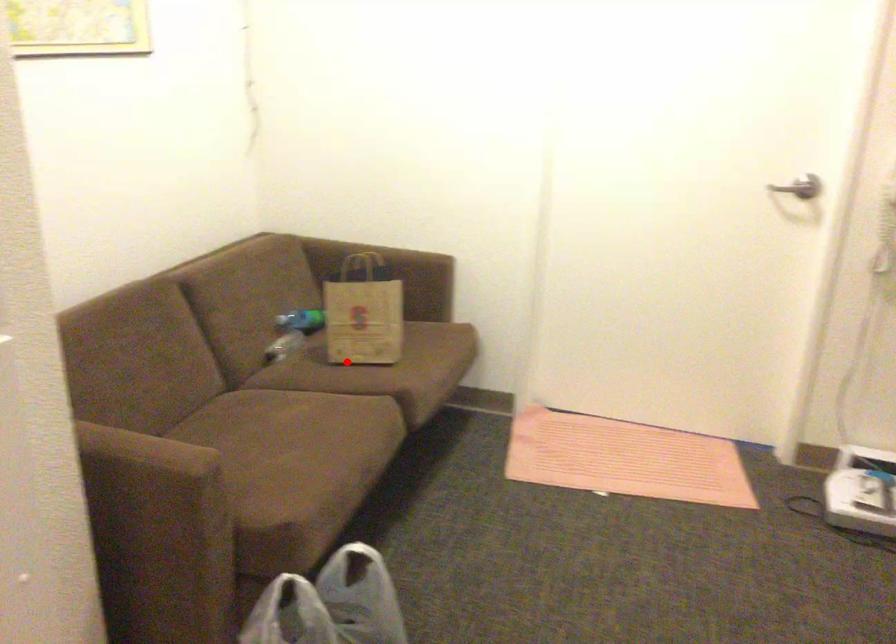
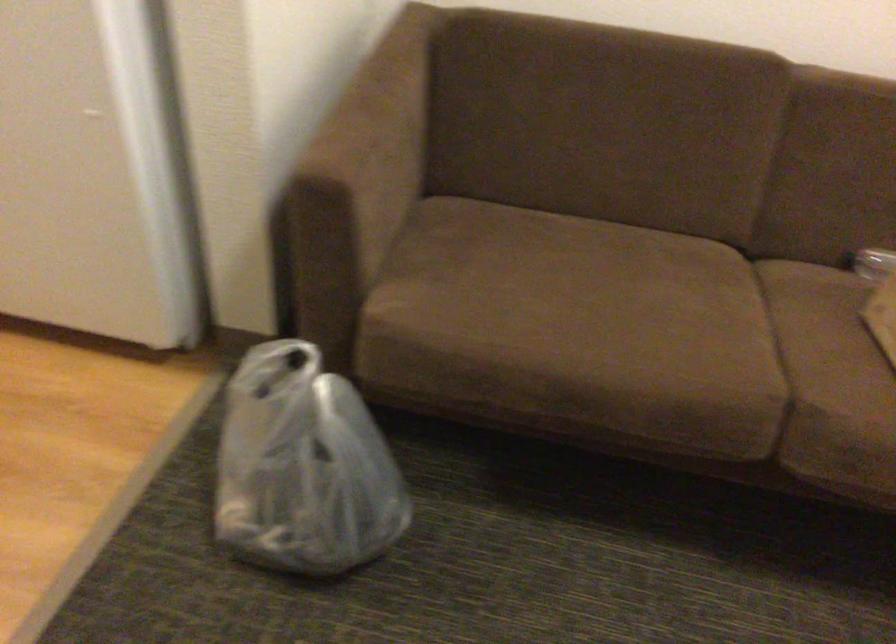
Question: I am providing you with two images of the same scene from different viewpoints. A red point is shown in image1. For the corresponding object point in image2, is it positioned nearer or farther from the camera?

Choices:
 (A) Nearer
 (B) Farther

Answer: (A)